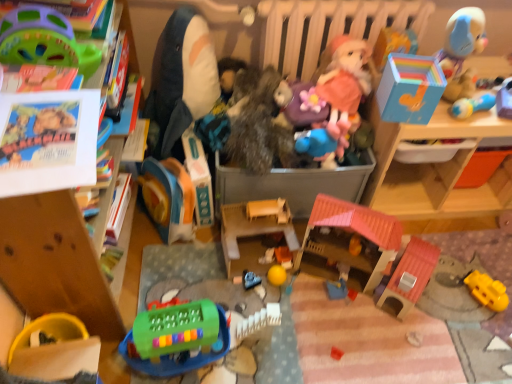
In order to click on vacant area that lies between yellow plastic blocks at lower right, acting as the fifteenth toy starting from the left, and green plastic keyboard at lower left, the 5th toy viewed from the left in this screenshot , I will do pyautogui.click(x=362, y=324).